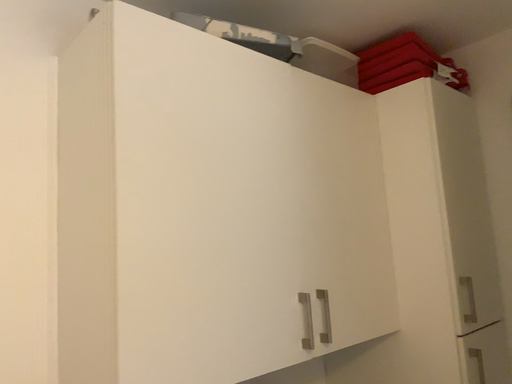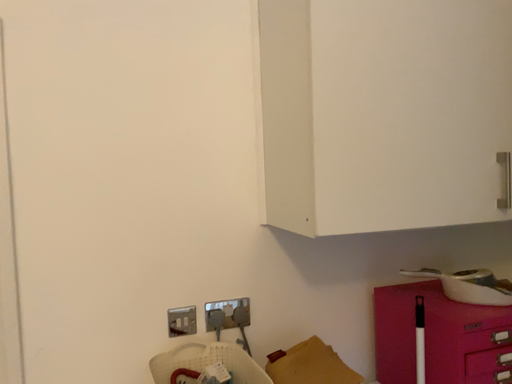
Question: Which way did the camera rotate in the video?

Choices:
 (A) rotated downward
 (B) rotated upward

Answer: (A)